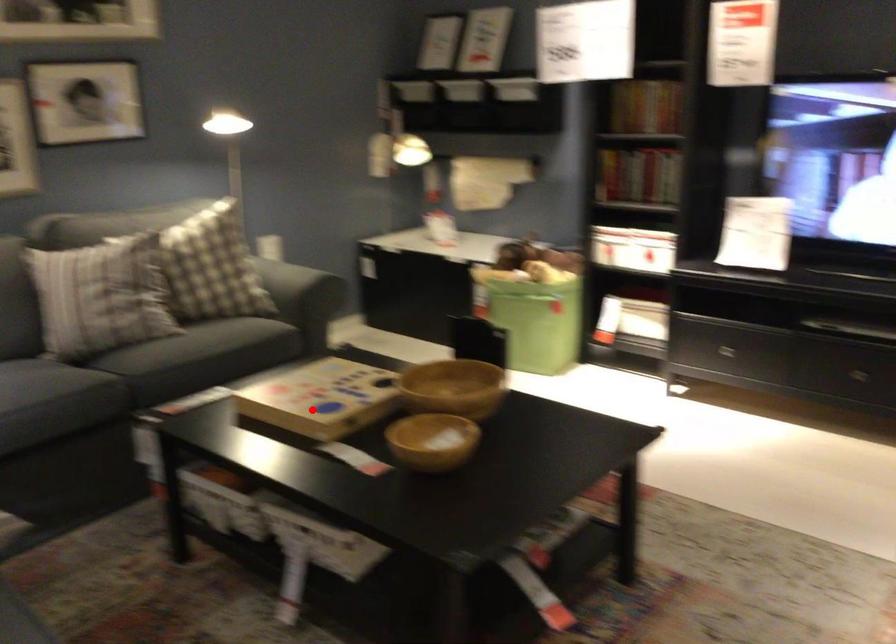
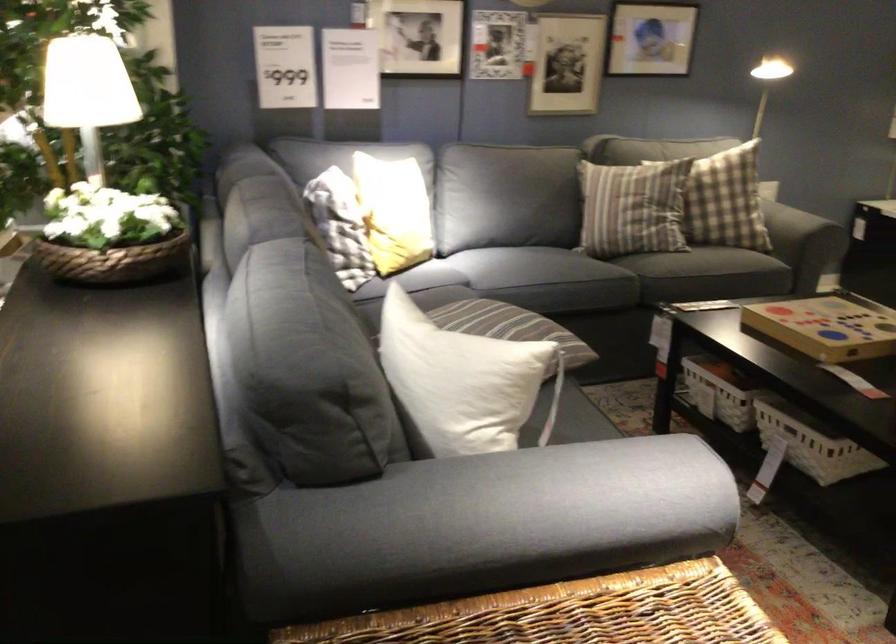
The point at the highlighted location is marked in the first image. Where is the corresponding point in the second image?

(828, 326)